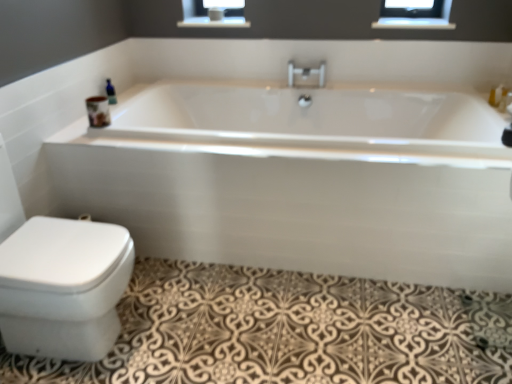
Describe the element at coordinates (110, 92) in the screenshot. The image size is (512, 384). I see `blue glass bottle at upper left` at that location.

Measure the distance between point (46, 279) and camera.

4.48 feet.

Where is `clear glass balustrade at upper center`? The image size is (512, 384). clear glass balustrade at upper center is located at coordinates (413, 23).

What is the approximate height of white glossy bathtub at center?

white glossy bathtub at center is 25.68 inches tall.

Describe the element at coordinates (306, 73) in the screenshot. Image resolution: width=512 pixels, height=384 pixels. I see `polished chrome faucet at center` at that location.

The height and width of the screenshot is (384, 512). Find the location of `blue glass bottle at upper left`. blue glass bottle at upper left is located at coordinates (110, 92).

How distant is white glossy bidet at lower left from polished chrome faucet at center?

white glossy bidet at lower left is 1.71 meters away from polished chrome faucet at center.

From a real-world perspective, between white glossy bidet at lower left and polished chrome faucet at center, who is vertically lower?

white glossy bidet at lower left, from a real-world perspective.

The image size is (512, 384). In order to click on bidet on the left of polished chrome faucet at center in this screenshot , I will do `click(63, 287)`.

Considering their positions, is white glossy bidet at lower left located in front of or behind polished chrome faucet at center?

In the image, white glossy bidet at lower left appears in front of polished chrome faucet at center.

Is polished chrome faucet at center behind blue glass bottle at upper left?

Yes.

Considering the points (293, 82) and (110, 95), which point is in front, point (293, 82) or point (110, 95)?

The point (110, 95) is more forward.

Can you confirm if polished chrome faucet at center is shorter than blue glass bottle at upper left?

Indeed, polished chrome faucet at center has a lesser height compared to blue glass bottle at upper left.

Which of these two, polished chrome faucet at center or blue glass bottle at upper left, is smaller?

Smaller between the two is blue glass bottle at upper left.

In the image, is blue glass bottle at upper left positioned in front of or behind white glossy bidet at lower left?

Clearly, blue glass bottle at upper left is behind white glossy bidet at lower left.

Is blue glass bottle at upper left far away from white glossy bidet at lower left?

blue glass bottle at upper left is positioned a significant distance from white glossy bidet at lower left.

You are a GUI agent. You are given a task and a screenshot of the screen. Output one action in this format:
    pyautogui.click(x=<x>, y=<y>)
    Task: Click on the bidet on the right of blue glass bottle at upper left
    
    Given the screenshot: What is the action you would take?
    pyautogui.click(x=63, y=287)

From the image's perspective, which is below, blue glass bottle at upper left or white glossy bidet at lower left?

From the image's view, white glossy bidet at lower left is below.

From the image's perspective, is clear glass balustrade at upper center under white glossy bidet at lower left?

Incorrect, from the image's perspective, clear glass balustrade at upper center is higher than white glossy bidet at lower left.

Is clear glass balustrade at upper center at the left side of white glossy bidet at lower left?

Incorrect, clear glass balustrade at upper center is not on the left side of white glossy bidet at lower left.

Looking at their sizes, would you say clear glass balustrade at upper center is wider or thinner than white glossy bidet at lower left?

Clearly, clear glass balustrade at upper center has less width compared to white glossy bidet at lower left.

From a real-world perspective, is clear glass balustrade at upper center physically above white glossy bidet at lower left?

Correct, in the physical world, clear glass balustrade at upper center is higher than white glossy bidet at lower left.

Is white glossy bidet at lower left inside the boundaries of brown textured bath mat at lower left, or outside?

white glossy bidet at lower left is not enclosed by brown textured bath mat at lower left.

In terms of height, does white glossy bidet at lower left look taller or shorter compared to brown textured bath mat at lower left?

In the image, white glossy bidet at lower left appears to be taller than brown textured bath mat at lower left.

From a real-world perspective, who is located lower, white glossy bidet at lower left or brown textured bath mat at lower left?

In real-world perspective, brown textured bath mat at lower left is lower.

Is white glossy bidet at lower left bigger than brown textured bath mat at lower left?

Indeed, white glossy bidet at lower left has a larger size compared to brown textured bath mat at lower left.

Who is shorter, blue glass bottle at upper left or white glossy bathtub at center?

Standing shorter between the two is blue glass bottle at upper left.

Does blue glass bottle at upper left have a larger size compared to white glossy bathtub at center?

No, blue glass bottle at upper left is not bigger than white glossy bathtub at center.

Between blue glass bottle at upper left and white glossy bathtub at center, which one has smaller width?

Thinner between the two is blue glass bottle at upper left.

From the image's perspective, between blue glass bottle at upper left and white glossy bathtub at center, which one is located above?

From the image's view, blue glass bottle at upper left is above.

Is white glossy bidet at lower left further to the viewer compared to clear glass balustrade at upper center?

That is False.

Could you tell me if white glossy bidet at lower left is turned towards clear glass balustrade at upper center?

No, white glossy bidet at lower left does not turn towards clear glass balustrade at upper center.

Can you see white glossy bidet at lower left touching clear glass balustrade at upper center?

No, white glossy bidet at lower left is not next to clear glass balustrade at upper center.

Based on the photo, is white glossy bidet at lower left shorter than clear glass balustrade at upper center?

Incorrect, the height of white glossy bidet at lower left does not fall short of that of clear glass balustrade at upper center.

Identify the location of bidet on the left of polished chrome faucet at center. The height and width of the screenshot is (384, 512). (63, 287).

Locate an element on the screen. tap above the blue glass bottle at upper left (from the image's perspective) is located at coordinates [306, 73].

Estimate the real-world distances between objects in this image. Which object is closer to blue glass bottle at upper left, white glossy bathtub at center or white glossy bidet at lower left?

The object closer to blue glass bottle at upper left is white glossy bathtub at center.

Looking at the image, which one is located further to white glossy bidet at lower left, brown textured bath mat at lower left or white glossy bathtub at center?

white glossy bathtub at center is further to white glossy bidet at lower left.

From the image, which object appears to be nearer to white glossy bidet at lower left, polished chrome faucet at center or blue glass bottle at upper left?

blue glass bottle at upper left lies closer to white glossy bidet at lower left than the other object.

Based on their spatial positions, is clear glass balustrade at upper center or polished chrome faucet at center further from white glossy bidet at lower left?

clear glass balustrade at upper center is further to white glossy bidet at lower left.

Based on their spatial positions, is blue glass bottle at upper left or brown textured bath mat at lower left closer to white glossy bathtub at center?

brown textured bath mat at lower left is closer to white glossy bathtub at center.

When comparing their distances from clear glass balustrade at upper center, does polished chrome faucet at center or blue glass bottle at upper left seem further?

blue glass bottle at upper left lies further to clear glass balustrade at upper center than the other object.

Looking at the image, which one is located further to white glossy bathtub at center, polished chrome faucet at center or brown textured bath mat at lower left?

polished chrome faucet at center lies further to white glossy bathtub at center than the other object.

Considering their positions, is polished chrome faucet at center positioned closer to blue glass bottle at upper left than white glossy bidet at lower left?

polished chrome faucet at center is closer to blue glass bottle at upper left.

Identify the location of bath mat located between white glossy bidet at lower left and clear glass balustrade at upper center in the left-right direction. This screenshot has width=512, height=384. (288, 331).

This screenshot has width=512, height=384. Identify the location of bathtub between blue glass bottle at upper left and polished chrome faucet at center in the horizontal direction. (300, 180).

What are the coordinates of `balustrade between white glossy bathtub at center and polished chrome faucet at center from front to back` in the screenshot? It's located at (413, 23).

Where is `bathtub situated between white glossy bidet at lower left and clear glass balustrade at upper center from left to right`? Image resolution: width=512 pixels, height=384 pixels. bathtub situated between white glossy bidet at lower left and clear glass balustrade at upper center from left to right is located at coordinates (300, 180).